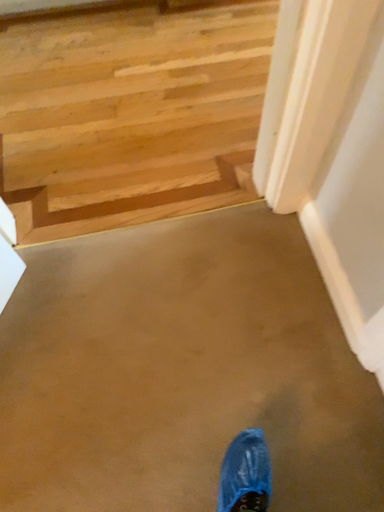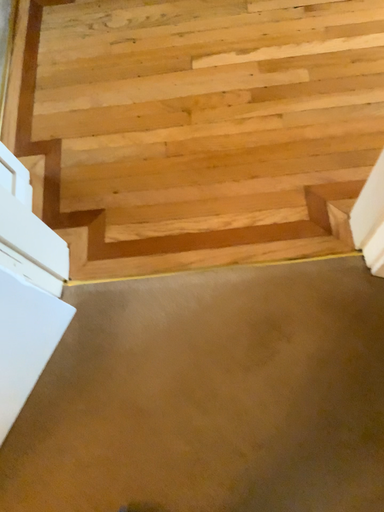
Question: How did the camera likely rotate when shooting the video?

Choices:
 (A) rotated downward
 (B) rotated upward

Answer: (A)